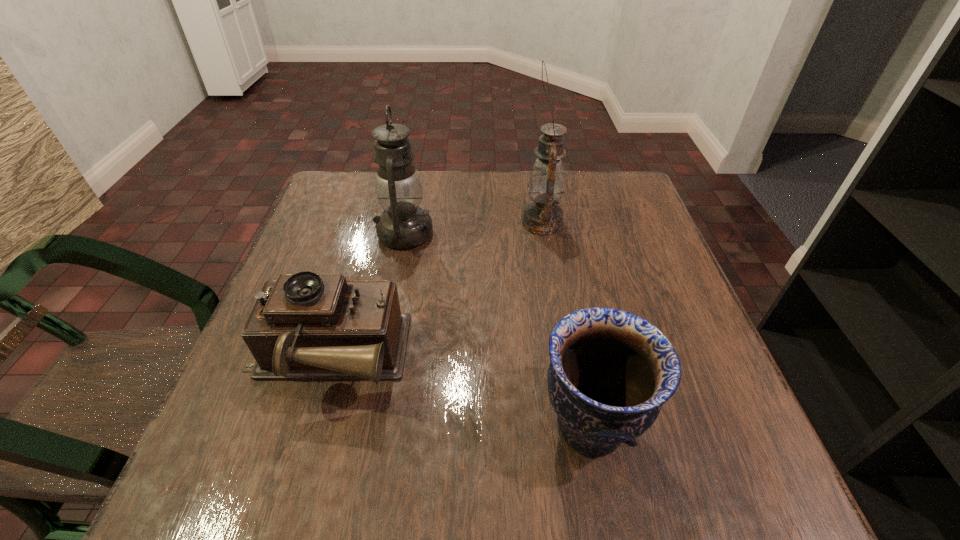
You are a GUI agent. You are given a task and a screenshot of the screen. Output one action in this format:
    pyautogui.click(x=<x>, y=<y>)
    Task: Click on the tallest object
    This screenshot has height=540, width=960.
    Given the screenshot: What is the action you would take?
    pyautogui.click(x=546, y=184)

Where is `the right oil lamp`? the right oil lamp is located at coordinates (546, 184).

In order to click on the left oil lamp in this screenshot , I will do `click(403, 225)`.

Find the location of a particular element. Image resolution: width=960 pixels, height=540 pixels. the shorter oil lamp is located at coordinates (403, 225).

In order to click on pottery in this screenshot , I will do `click(610, 372)`.

You are a GUI agent. You are given a task and a screenshot of the screen. Output one action in this format:
    pyautogui.click(x=<x>, y=<y>)
    Task: Click on the phonograph_record
    The image size is (960, 540).
    Given the screenshot: What is the action you would take?
    (x=306, y=326)

What are the coordinates of `vacant space situated on the front of the taller oil lamp` in the screenshot? It's located at click(559, 322).

Locate an element on the screen. This screenshot has height=540, width=960. vacant region located 0.050m on the right of the third shortest object is located at coordinates (454, 234).

This screenshot has height=540, width=960. In order to click on free space located on the front handle of the pottery in this screenshot , I will do `click(379, 426)`.

Where is `free space located 0.120m on the front handle of the pottery`? This screenshot has height=540, width=960. free space located 0.120m on the front handle of the pottery is located at coordinates (461, 426).